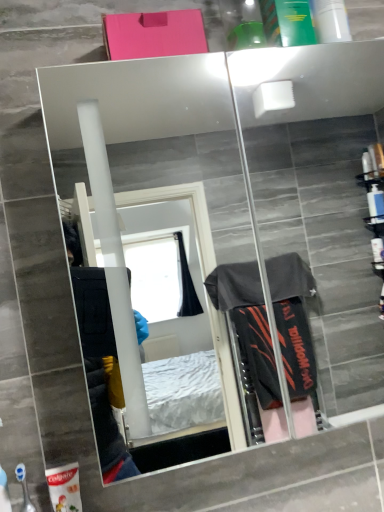
This screenshot has height=512, width=384. Describe the element at coordinates (24, 488) in the screenshot. I see `blue plastic toothbrush at lower left, which is the 1th toiletry from front to back` at that location.

What are the coordinates of `white matte toothpaste tube at lower left, arranged as the first toiletry when viewed from the back` in the screenshot? It's located at (64, 488).

Where is `mirror glass at upper center`? mirror glass at upper center is located at coordinates (162, 176).

Is white matte toothpaste tube at lower left, arranged as the first toiletry when viewed from the back, positioned with its back to blue plastic toothbrush at lower left, which is the 1th toiletry from front to back?

No, white matte toothpaste tube at lower left, arranged as the first toiletry when viewed from the back, is not facing away from blue plastic toothbrush at lower left, which is the 1th toiletry from front to back.

Which is in front, point (52, 490) or point (25, 487)?

The point (25, 487) is more forward.

Considering the relative sizes of white matte toothpaste tube at lower left, arranged as the first toiletry when viewed from the back, and blue plastic toothbrush at lower left, positioned as the 2th toiletry in back-to-front order, in the image provided, is white matte toothpaste tube at lower left, arranged as the first toiletry when viewed from the back, smaller than blue plastic toothbrush at lower left, positioned as the 2th toiletry in back-to-front order,?

No.

Does point (18, 467) lie behind point (72, 487)?

That is True.

Which is more to the left, blue plastic toothbrush at lower left, positioned as the 2th toiletry in back-to-front order, or white matte toothpaste tube at lower left, the second toiletry when ordered from front to back?

Positioned to the left is blue plastic toothbrush at lower left, positioned as the 2th toiletry in back-to-front order.

Can you confirm if blue plastic toothbrush at lower left, which is the 1th toiletry from front to back, is smaller than white matte toothpaste tube at lower left, arranged as the first toiletry when viewed from the back?

Yes.

Is blue plastic toothbrush at lower left, positioned as the 2th toiletry in back-to-front order, facing away from mirror glass at upper center?

That's not correct — blue plastic toothbrush at lower left, positioned as the 2th toiletry in back-to-front order, is not looking away from mirror glass at upper center.

From the image's perspective, between blue plastic toothbrush at lower left, which is the 1th toiletry from front to back, and mirror glass at upper center, who is located below?

blue plastic toothbrush at lower left, which is the 1th toiletry from front to back.

Can mirror glass at upper center be found inside blue plastic toothbrush at lower left, which is the 1th toiletry from front to back?

No, mirror glass at upper center is located outside of blue plastic toothbrush at lower left, which is the 1th toiletry from front to back.

Can you tell me how much blue plastic toothbrush at lower left, positioned as the 2th toiletry in back-to-front order, and mirror glass at upper center differ in facing direction?

95.1 degrees.

Is mirror glass at upper center not inside white matte toothpaste tube at lower left, arranged as the first toiletry when viewed from the back?

mirror glass at upper center is positioned outside white matte toothpaste tube at lower left, arranged as the first toiletry when viewed from the back.

In the image, is mirror glass at upper center on the left side or the right side of white matte toothpaste tube at lower left, arranged as the first toiletry when viewed from the back?

mirror glass at upper center is to the right of white matte toothpaste tube at lower left, arranged as the first toiletry when viewed from the back.

Looking at this image, is mirror glass at upper center oriented away from white matte toothpaste tube at lower left, arranged as the first toiletry when viewed from the back?

No, mirror glass at upper center's orientation is not away from white matte toothpaste tube at lower left, arranged as the first toiletry when viewed from the back.

In the scene shown: From a real-world perspective, does mirror glass at upper center stand above blue plastic toothbrush at lower left, which is the 1th toiletry from front to back?

Yes.

In the scene shown: From the image's perspective, between mirror glass at upper center and blue plastic toothbrush at lower left, positioned as the 2th toiletry in back-to-front order, who is located below?

blue plastic toothbrush at lower left, positioned as the 2th toiletry in back-to-front order, is shown below in the image.

Is point (222, 316) positioned before point (27, 504)?

No, (222, 316) is further to viewer.

Can you confirm if white matte toothpaste tube at lower left, arranged as the first toiletry when viewed from the back, is thinner than mirror glass at upper center?

Indeed, white matte toothpaste tube at lower left, arranged as the first toiletry when viewed from the back, has a lesser width compared to mirror glass at upper center.

Where is `the 2nd toiletry below the mirror glass at upper center (from the image's perspective)`? The image size is (384, 512). the 2nd toiletry below the mirror glass at upper center (from the image's perspective) is located at coordinates (64, 488).

Which is behind, point (53, 497) or point (191, 96)?

The point (191, 96) is farther from the camera.

Can you confirm if white matte toothpaste tube at lower left, the second toiletry when ordered from front to back, is smaller than mirror glass at upper center?

Yes.

Locate an element on the screen. The height and width of the screenshot is (512, 384). toiletry directly beneath the blue plastic toothbrush at lower left, which is the 1th toiletry from front to back (from a real-world perspective) is located at coordinates (64, 488).

Locate an element on the screen. The image size is (384, 512). toiletry that appears in front of the white matte toothpaste tube at lower left, arranged as the first toiletry when viewed from the back is located at coordinates (24, 488).

Based on their spatial positions, is white matte toothpaste tube at lower left, the second toiletry when ordered from front to back, or mirror glass at upper center further from blue plastic toothbrush at lower left, positioned as the 2th toiletry in back-to-front order?

mirror glass at upper center is further to blue plastic toothbrush at lower left, positioned as the 2th toiletry in back-to-front order.

From the image, which object appears to be farther from mirror glass at upper center, white matte toothpaste tube at lower left, arranged as the first toiletry when viewed from the back, or blue plastic toothbrush at lower left, which is the 1th toiletry from front to back?

The object further to mirror glass at upper center is blue plastic toothbrush at lower left, which is the 1th toiletry from front to back.

From the image, which object appears to be nearer to white matte toothpaste tube at lower left, arranged as the first toiletry when viewed from the back, mirror glass at upper center or blue plastic toothbrush at lower left, positioned as the 2th toiletry in back-to-front order?

blue plastic toothbrush at lower left, positioned as the 2th toiletry in back-to-front order, lies closer to white matte toothpaste tube at lower left, arranged as the first toiletry when viewed from the back, than the other object.

Estimate the real-world distances between objects in this image. Which object is closer to white matte toothpaste tube at lower left, the second toiletry when ordered from front to back, blue plastic toothbrush at lower left, which is the 1th toiletry from front to back, or mirror glass at upper center?

blue plastic toothbrush at lower left, which is the 1th toiletry from front to back, is closer to white matte toothpaste tube at lower left, the second toiletry when ordered from front to back.

Considering their positions, is mirror glass at upper center positioned closer to blue plastic toothbrush at lower left, positioned as the 2th toiletry in back-to-front order, than white matte toothpaste tube at lower left, the second toiletry when ordered from front to back?

white matte toothpaste tube at lower left, the second toiletry when ordered from front to back, is positioned closer to the anchor blue plastic toothbrush at lower left, positioned as the 2th toiletry in back-to-front order.

Estimate the real-world distances between objects in this image. Which object is closer to mirror glass at upper center, blue plastic toothbrush at lower left, which is the 1th toiletry from front to back, or white matte toothpaste tube at lower left, the second toiletry when ordered from front to back?

white matte toothpaste tube at lower left, the second toiletry when ordered from front to back.

The height and width of the screenshot is (512, 384). Find the location of `toiletry between mirror glass at upper center and white matte toothpaste tube at lower left, arranged as the first toiletry when viewed from the back, from top to bottom`. toiletry between mirror glass at upper center and white matte toothpaste tube at lower left, arranged as the first toiletry when viewed from the back, from top to bottom is located at coordinates (24, 488).